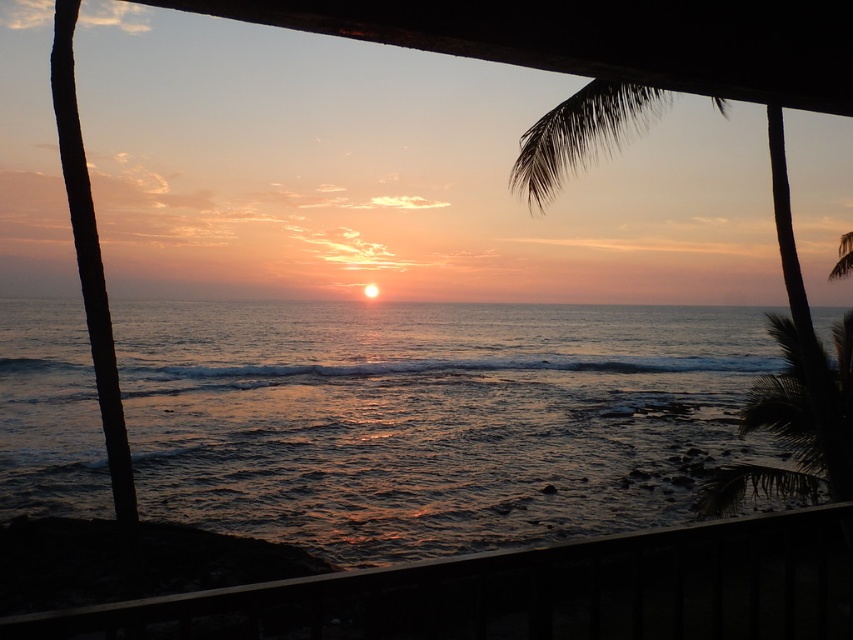
You are standing on the balcony and want to take a photo of the sunset. You have a camera with a zoom lens that can focus up to 20 meters. Can you capture both the smooth wooden railing at lower center and the green leafy palm tree at upper right in the same photo without moving the camera?

The smooth wooden railing at lower center is 20.60 meters away from the green leafy palm tree at upper right. Since the distance between them exceeds the camera lens zoom range of 20 meters, you cannot capture both in the same photo without moving the camera.